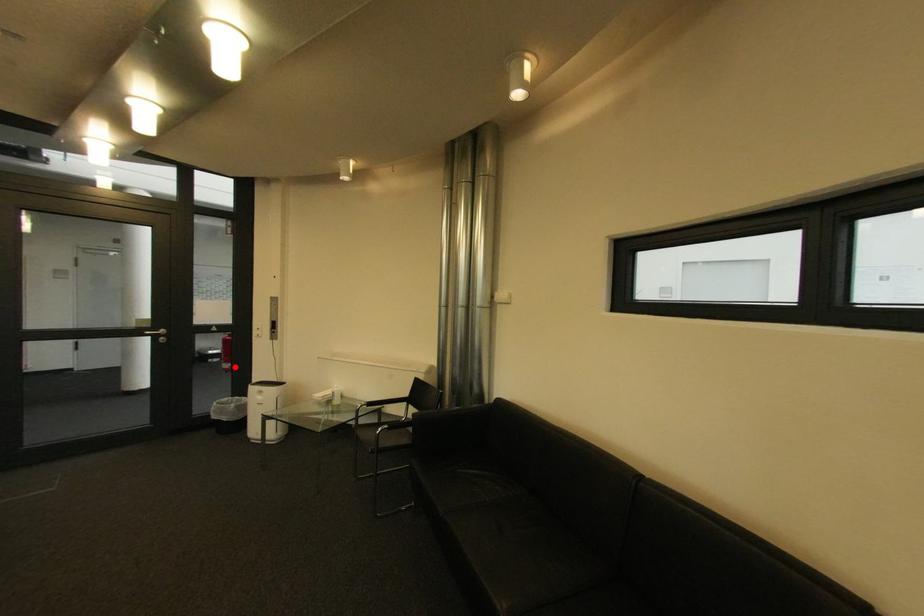
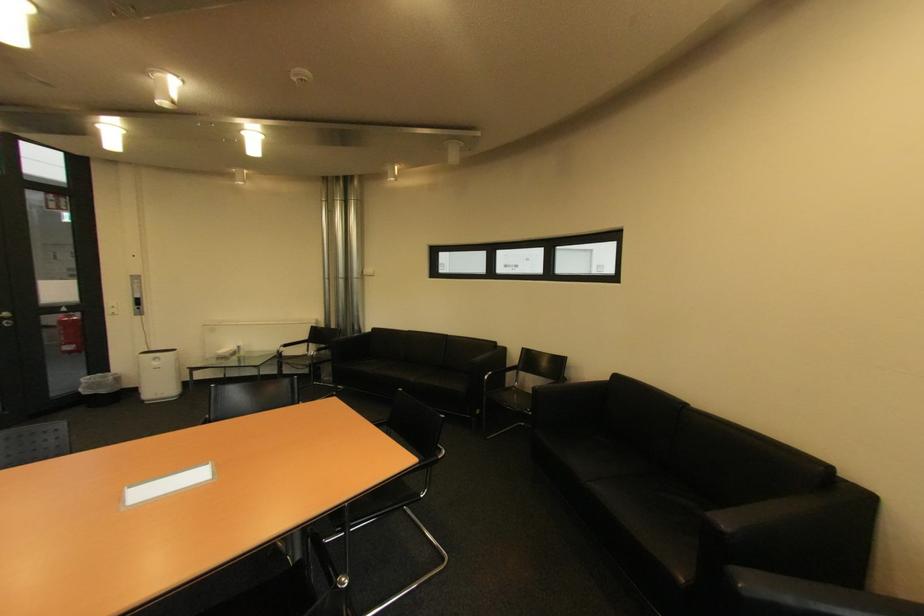
Find the pixel in the second image that matches the highlighted location in the first image.

(79, 349)